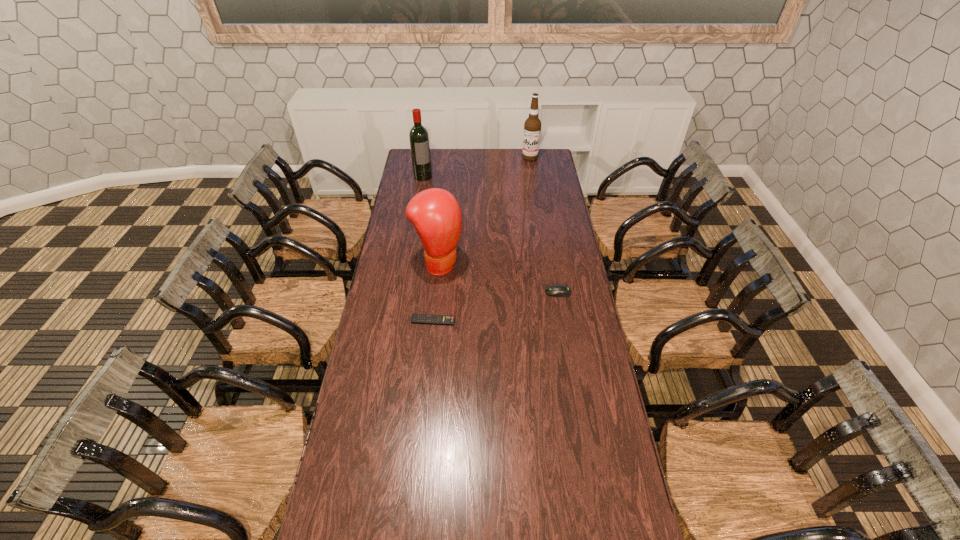
Point out which object is positioned as the nearest to the fourth nearest object. Please provide its 2D coordinates. Your answer should be formatted as a tuple, i.e. [(x, y)], where the tuple contains the x and y coordinates of a point satisfying the conditions above.

[(435, 213)]

Locate an element on the screen. This screenshot has height=540, width=960. object that stands as the second closest to the boxing glove is located at coordinates (557, 290).

Where is `free spot that satisfies the following two spatial constraints: 1. on the front side of the third farthest object; 2. on the right side of the wine bottle`? free spot that satisfies the following two spatial constraints: 1. on the front side of the third farthest object; 2. on the right side of the wine bottle is located at coordinates [x=409, y=262].

Image resolution: width=960 pixels, height=540 pixels. Find the location of `vacant point that satisfies the following two spatial constraints: 1. on the front side of the nearest object; 2. on the left side of the wine bottle`. vacant point that satisfies the following two spatial constraints: 1. on the front side of the nearest object; 2. on the left side of the wine bottle is located at coordinates (399, 321).

In order to click on vacant position in the image that satisfies the following two spatial constraints: 1. on the front side of the farthest object; 2. on the wheel side of the computer mouse in this screenshot , I will do `click(551, 292)`.

Locate an element on the screen. free region that satisfies the following two spatial constraints: 1. on the back side of the alcohol; 2. on the left side of the wine bottle is located at coordinates pyautogui.click(x=426, y=158).

This screenshot has height=540, width=960. Identify the location of free space in the image that satisfies the following two spatial constraints: 1. on the front side of the third farthest object; 2. on the wheel side of the fourth tallest object. (436, 292).

I want to click on vacant point that satisfies the following two spatial constraints: 1. on the back side of the boxing glove; 2. on the left side of the remote control, so click(x=439, y=262).